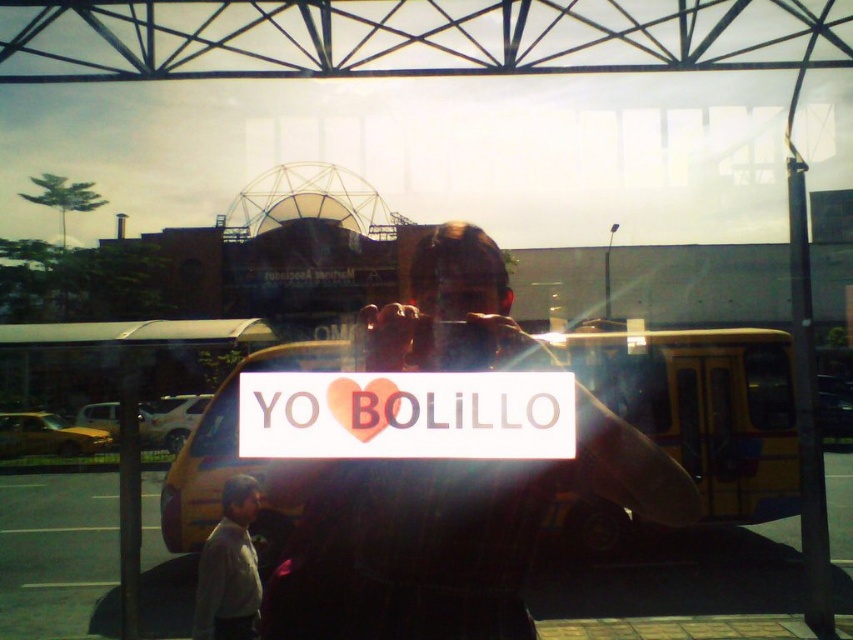
Question: Is matte black sign at center below yellow matte school bus at center?

Choices:
 (A) no
 (B) yes

Answer: (A)

Question: Considering the real-world distances, which object is closest to the gray fabric shirt at lower left?

Choices:
 (A) yellow matte school bus at center
 (B) white matte sign at center
 (C) matte black sign at center

Answer: (C)

Question: Can you confirm if matte black sign at center is wider than gray fabric shirt at lower left?

Choices:
 (A) no
 (B) yes

Answer: (B)

Question: Among these points, which one is farthest from the camera?

Choices:
 (A) (746, 403)
 (B) (235, 596)
 (C) (425, 513)

Answer: (A)

Question: Which of the following is the farthest from the observer?

Choices:
 (A) (252, 595)
 (B) (334, 595)
 (C) (780, 481)

Answer: (C)

Question: Does matte black sign at center have a larger size compared to gray fabric shirt at lower left?

Choices:
 (A) yes
 (B) no

Answer: (A)